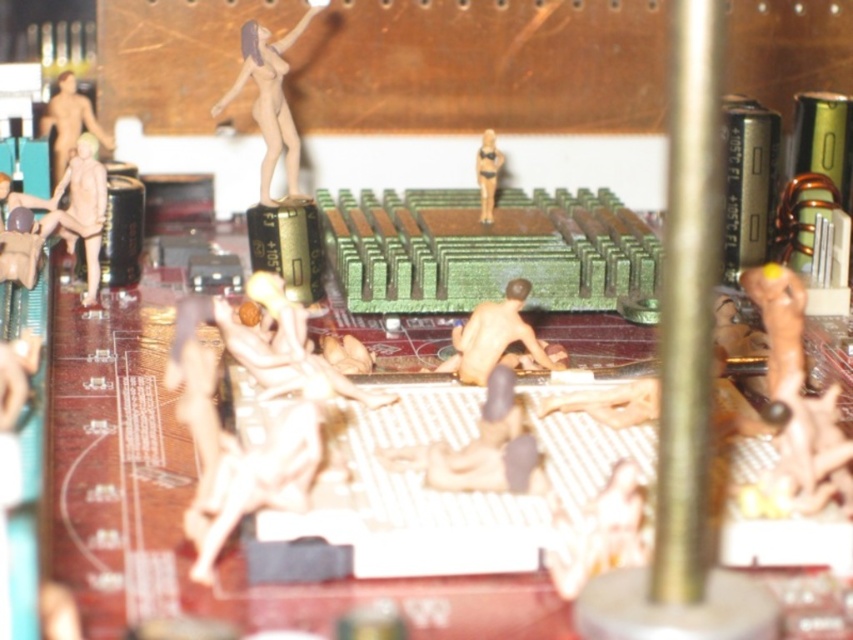
You are an artist who wants to move the matte yellow bikini at center to another location without disturbing the matte plastic nude figure at upper center. Is this possible based on their current positions?

The matte plastic nude figure at upper center is positioned over the matte yellow bikini at center, so moving the bikini without disturbing the figure might be challenging. The figure is directly above the bikini, making it difficult to access the bikini without moving the figure first.

You are an observer looking at the diorama scene. There are two items at the center of the image, a nude figure at center and a matte yellow bikini at center. Which one is located to the right?

The nude figure at center is positioned on the right side of the matte yellow bikini at center, so the nude figure at center is the one located to the right.